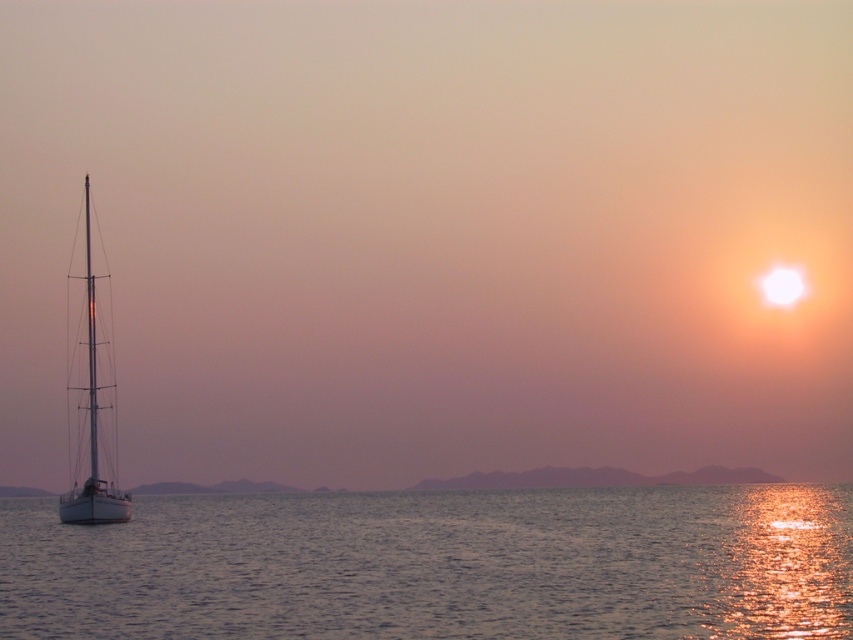
You are standing on the deck of the sailboat in the sunset scene. You notice two points marked in the image. Which point, point (839,538) or point (97,509), is closer to you?

Point (839,538) is closer to the camera than point (97,509).

You are an artist planning to paint the sunset scene. You want to ensure the glistening silver water at lower left and the white glossy sailboat at left are proportionally accurate. Which object should you draw first to maintain scale, and why?

You should draw the white glossy sailboat at left first because the glistening silver water at lower left is smaller in size compared to it, ensuring proper scaling when adding the smaller water area afterward.